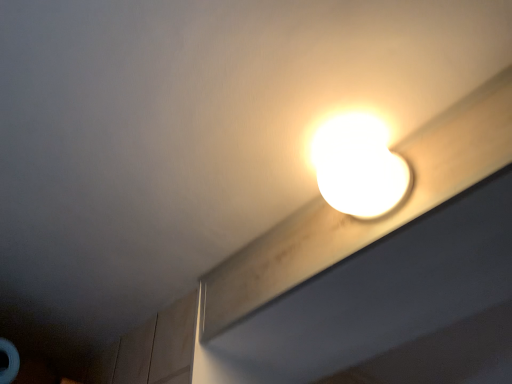
The height and width of the screenshot is (384, 512). What do you see at coordinates (359, 167) in the screenshot?
I see `white glossy light bulb at upper right` at bounding box center [359, 167].

At what (x,y) coordinates should I click in order to perform the action: click on white glossy light bulb at upper right. Please return your answer as a coordinate pair (x, y). Looking at the image, I should click on click(359, 167).

At what (x,y) coordinates should I click in order to perform the action: click on white glossy light bulb at upper right. Please return your answer as a coordinate pair (x, y). Looking at the image, I should click on (359, 167).